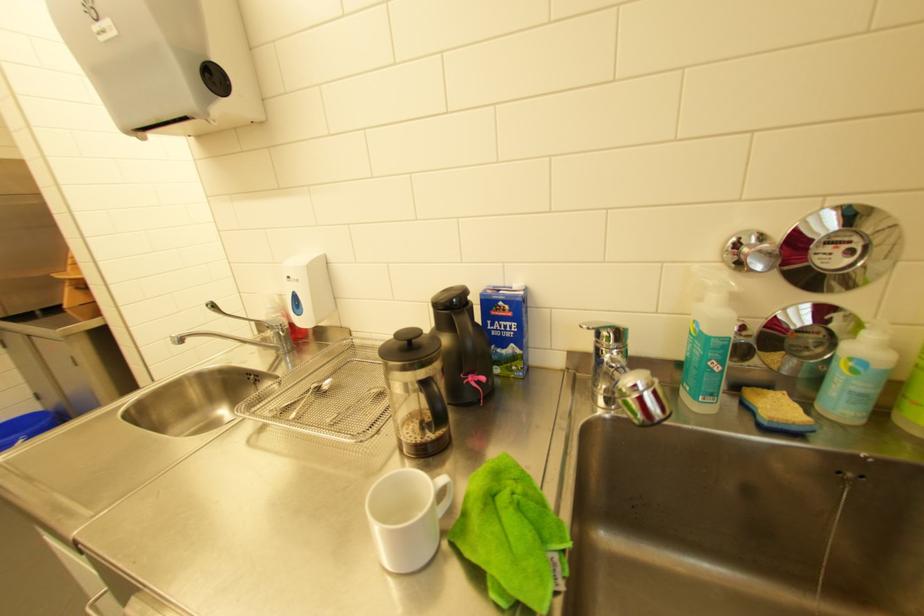
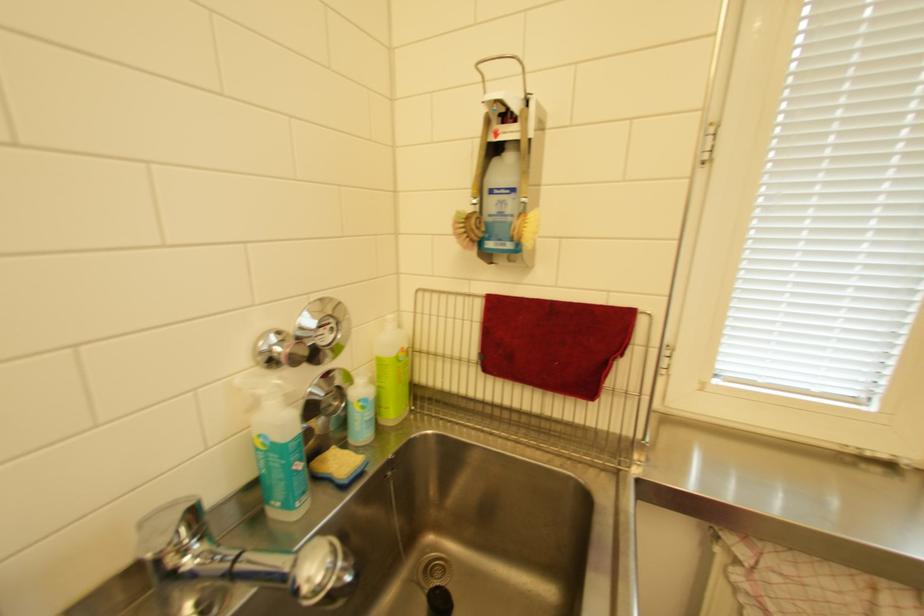
Locate, in the second image, the point that corresponds to the point at 858,360 in the first image.

(367, 400)